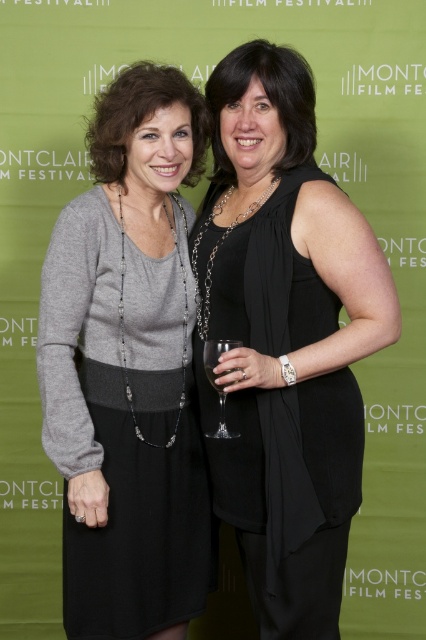
You are standing in front of the Montclair Film Festival banner at Air Hall. You notice two points marked on the banner. Which point is closer to you, point (337, 376) or point (215, 385)?

Point (337, 376) is closer to you because it is further to the viewer than point (215, 385).

You are at a film festival event and see two items at center. The matte gray sweater at center and the clear glass wine glass at center. Which one is positioned to the left?

The matte gray sweater at center is to the left of the clear glass wine glass at center.